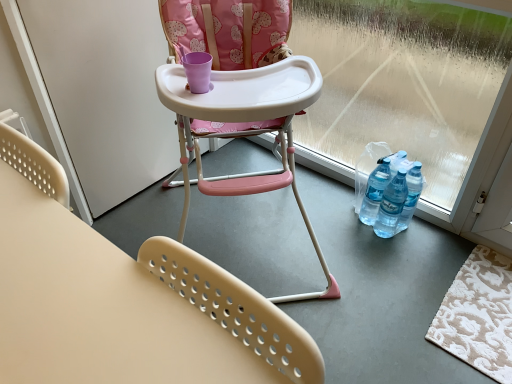
Find the location of a particular element. free space behind beige textured rug at lower right is located at coordinates (429, 244).